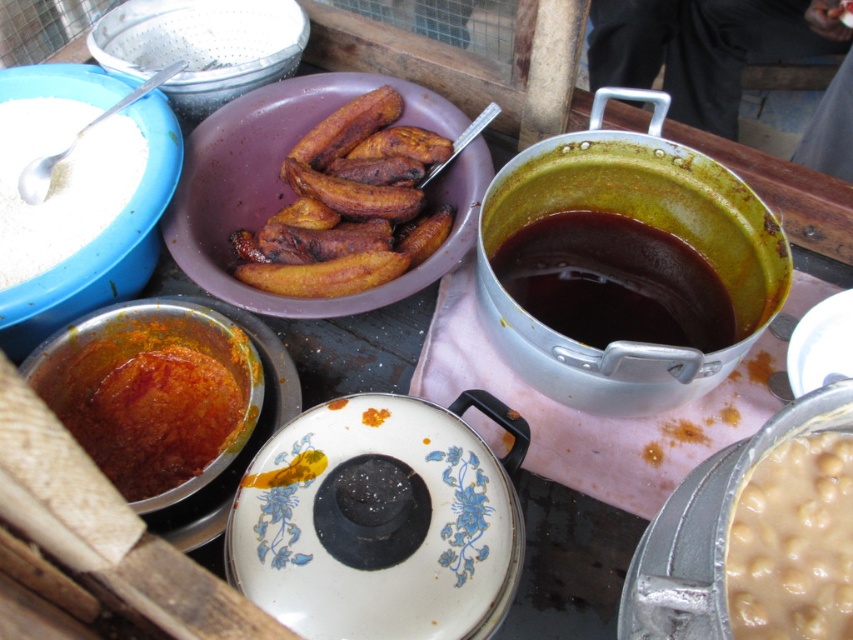
Question: Which object appears closest to the camera in this image?

Choices:
 (A) brushed metal strainer at upper left
 (B) brown matte plantains at center
 (C) white matte bowl at upper left
 (D) thick orange paste at center left

Answer: (D)

Question: Where is thick orange paste at center left located in relation to creamy beige beans at center in the image?

Choices:
 (A) below
 (B) above

Answer: (B)

Question: Does thick orange paste at center left lie in front of brown matte plantains at center?

Choices:
 (A) no
 (B) yes

Answer: (B)

Question: Which object is the closest to the thick orange paste at center left?

Choices:
 (A) brushed metal strainer at upper left
 (B) brown matte plantains at center
 (C) white matte bowl at upper left

Answer: (C)

Question: Among these objects, which one is farthest from the camera?

Choices:
 (A) brown matte plantains at center
 (B) creamy beige beans at center

Answer: (A)

Question: From the image, what is the correct spatial relationship of brown matte plantains at center in relation to creamy beige beans at center?

Choices:
 (A) left
 (B) right

Answer: (A)